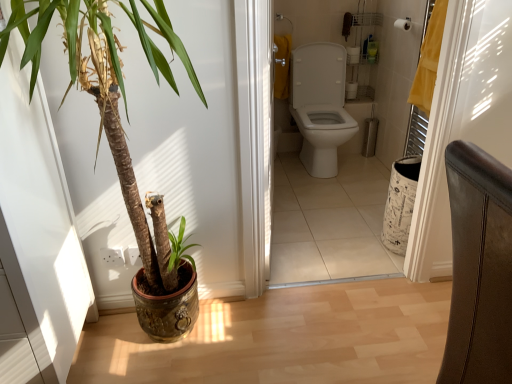
Identify the location of free location to the right of green glossy plant at left. (275, 332).